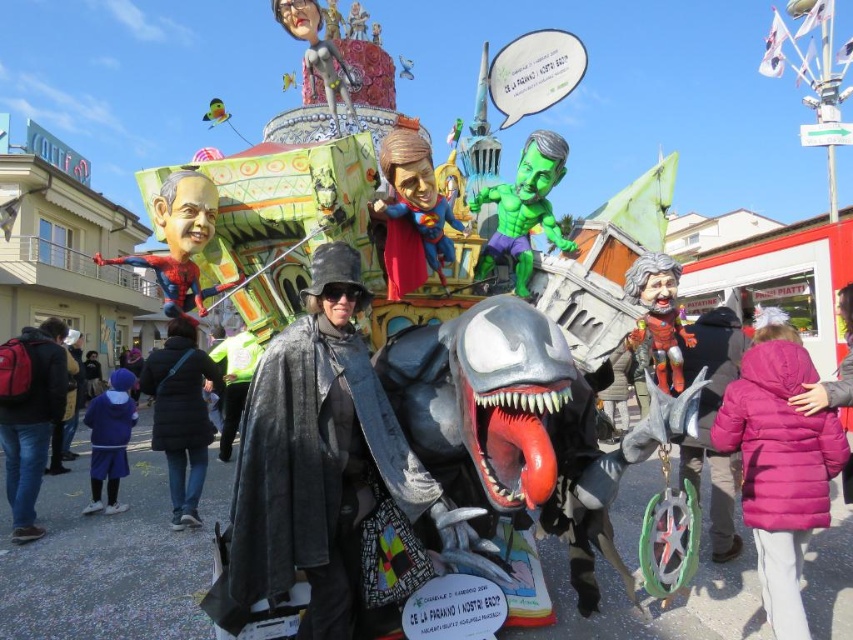
Who is more distant from viewer, (764, 608) or (97, 460)?

Positioned behind is point (97, 460).

Who is taller, pink puffy coat at lower right or blue fabric pants at lower left?

Standing taller between the two is pink puffy coat at lower right.

Is point (839, 470) positioned in front of point (126, 406)?

Yes, it is.

Where is `pink puffy coat at lower right`? The width and height of the screenshot is (853, 640). pink puffy coat at lower right is located at coordinates (780, 468).

Can you confirm if matte brown wooden figure at center is wider than blue fabric pants at lower left?

Incorrect, matte brown wooden figure at center's width does not surpass blue fabric pants at lower left's.

Is point (660, 337) positioned after point (96, 419)?

That is False.

The image size is (853, 640). Find the location of `matte brown wooden figure at center`. matte brown wooden figure at center is located at coordinates (659, 316).

Is black leather cape at center further to the viewer compared to blue fabric pants at lower left?

No.

Identify the location of black leather cape at center. (312, 477).